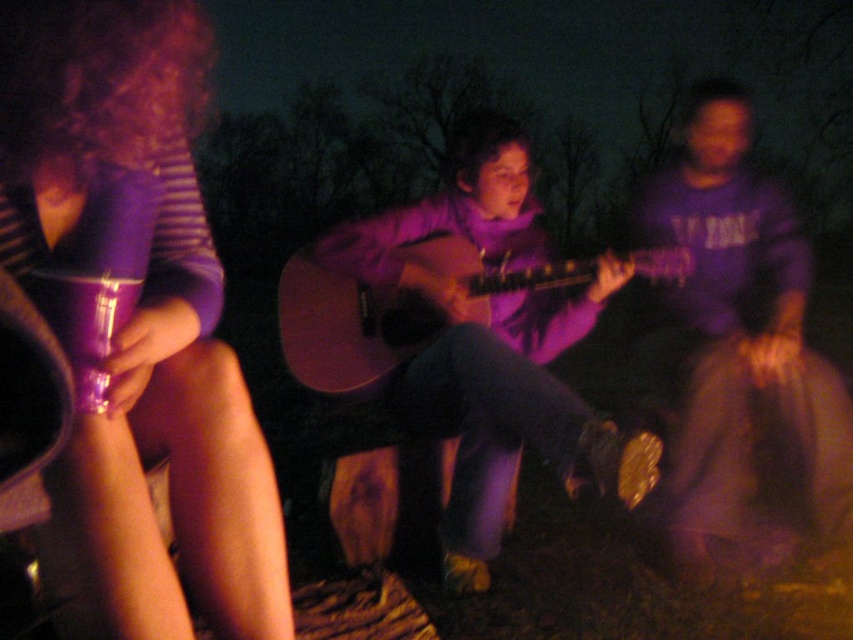
Which of these two, matte purple cup at left or matte acoustic guitar at center, stands shorter?

With less height is matte acoustic guitar at center.

Can you confirm if matte purple cup at left is wider than matte acoustic guitar at center?

No, matte purple cup at left is not wider than matte acoustic guitar at center.

At what (x,y) coordinates should I click in order to perform the action: click on matte purple cup at left. Please return your answer as a coordinate pair (x, y). Looking at the image, I should click on (142, 314).

Find the location of a particular element. matte purple cup at left is located at coordinates (142, 314).

Who is taller, matte purple cup at left or purple matte guitar at center?

purple matte guitar at center

The height and width of the screenshot is (640, 853). What are the coordinates of `matte purple cup at left` in the screenshot? It's located at (142, 314).

Describe the element at coordinates (492, 346) in the screenshot. I see `purple matte guitar at center` at that location.

Who is higher up, purple matte guitar at center or matte acoustic guitar at center?

Answer: matte acoustic guitar at center

Which is in front, point (497, 221) or point (293, 273)?

Point (293, 273)

Where is `purple matte guitar at center`? purple matte guitar at center is located at coordinates (492, 346).